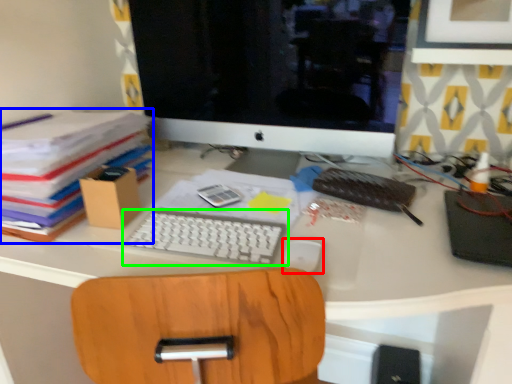
Question: Considering the real-world distances, which object is farthest from mouse (highlighted by a red box)? paperback book (highlighted by a blue box) or computer keyboard (highlighted by a green box)?

Choices:
 (A) paperback book
 (B) computer keyboard

Answer: (A)